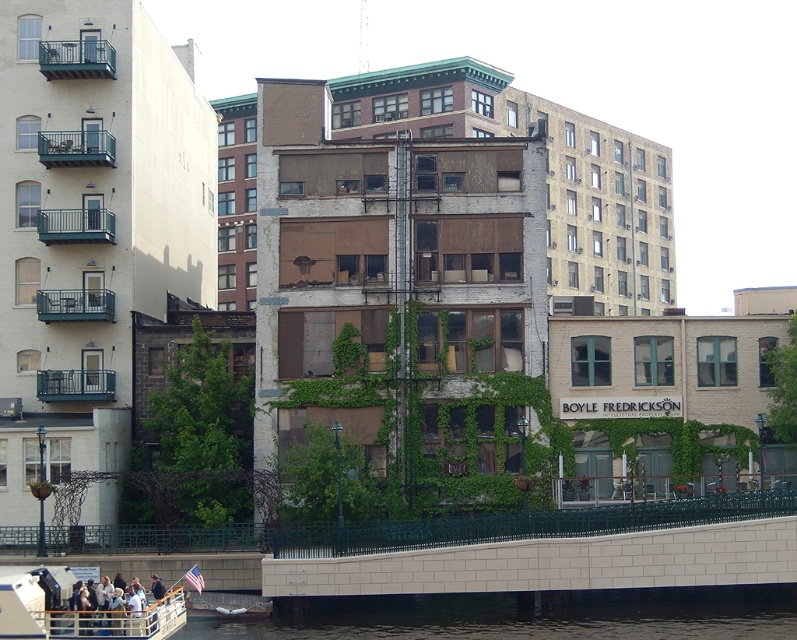
You are a construction worker planning to place a 2 meter tall safety barrier between the black concrete water at lower center and the white plastic boat at lower left. Based on the scene description, will the barrier be taller than both objects?

The black concrete water at lower center has a lesser height compared to white plastic boat at lower left. Since the barrier is 2 meters tall, it will be taller than both objects.

You are standing at the center of the image and want to walk towards the black concrete water at lower center. What are the coordinates you should head towards?

You should head towards the coordinates point (525, 616) as that is where the black concrete water at lower center is located.

You are standing at point (179, 618) and want to walk to point (391, 621). Is the destination point behind you or in front of you?

The destination point (391, 621) is behind point (179, 618), so it is behind you.